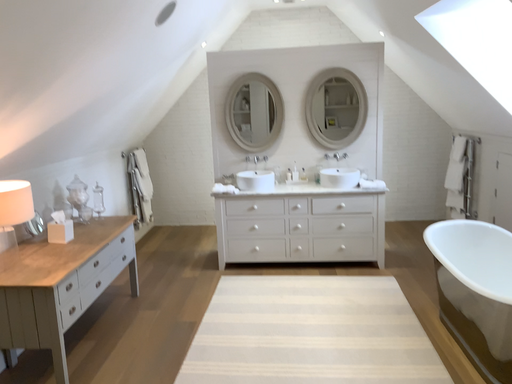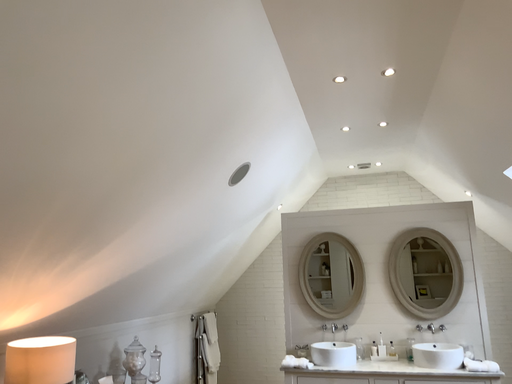
Question: Which way did the camera rotate in the video?

Choices:
 (A) rotated downward
 (B) rotated upward

Answer: (B)